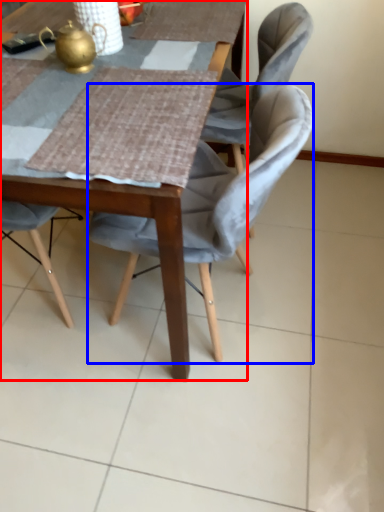
Question: Which object appears farthest to the camera in this image, table (highlighted by a red box) or chair (highlighted by a blue box)?

Choices:
 (A) table
 (B) chair

Answer: (B)